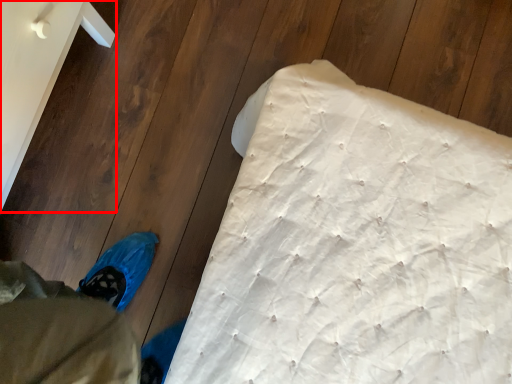
Question: From the image's perspective, where is furniture (annotated by the red box) located in relation to mattress in the image?

Choices:
 (A) below
 (B) above

Answer: (B)